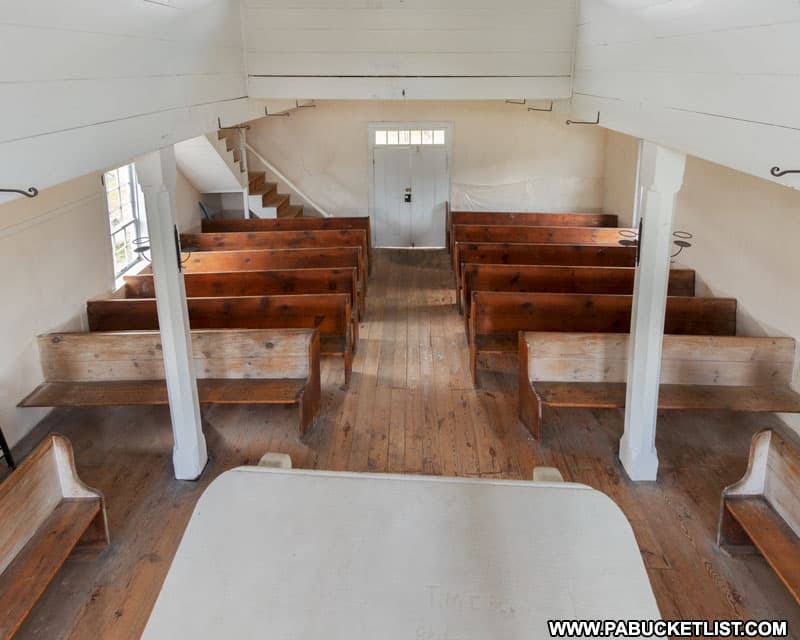
The height and width of the screenshot is (640, 800). I want to click on stair case, so click(x=270, y=194), click(x=214, y=154).